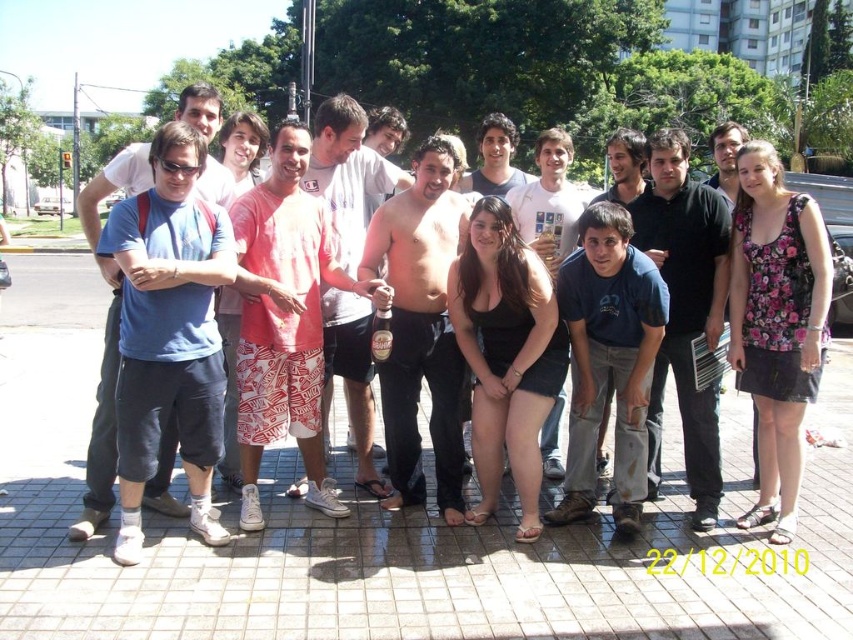
Question: Can you confirm if shiny black shorts at center is positioned to the left of translucent plastic bottle at center?

Choices:
 (A) no
 (B) yes

Answer: (A)

Question: Which point is farther to the camera?

Choices:
 (A) shiny metallic can at center
 (B) matte black shirt at center

Answer: (A)

Question: Does shiny black shorts at center appear under smooth gray shirt at center?

Choices:
 (A) no
 (B) yes

Answer: (B)

Question: Based on their relative distances, which object is nearer to the shiny metallic can at center?

Choices:
 (A) translucent plastic bottle at center
 (B) shiny black shorts at center

Answer: (A)

Question: Does matte black shirt at center appear on the left side of smooth gray shirt at center?

Choices:
 (A) yes
 (B) no

Answer: (A)

Question: Among these objects, which one is nearest to the camera?

Choices:
 (A) black cotton shirt at center
 (B) shiny black shorts at center

Answer: (A)